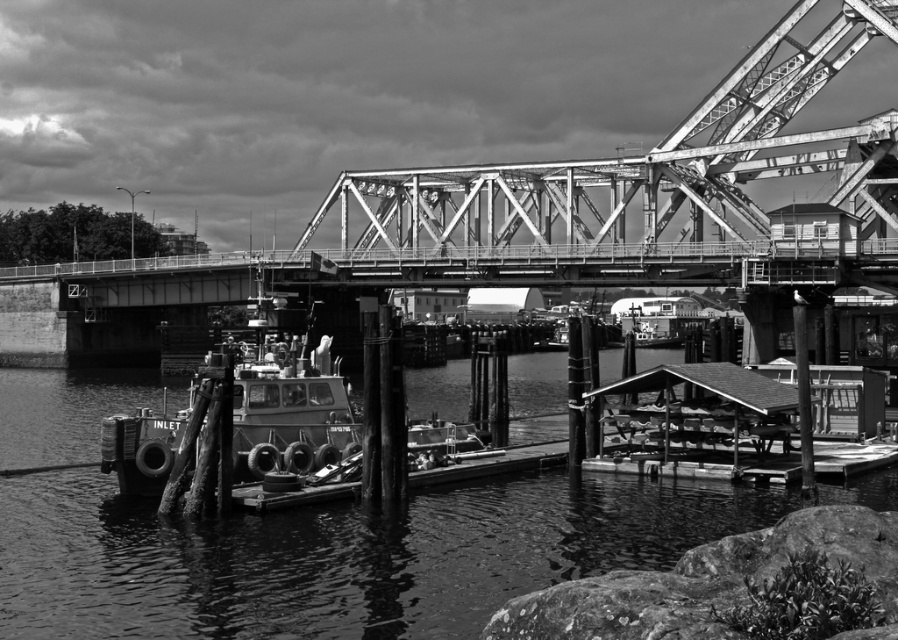
Question: Is smooth water at dock center thinner than metallic boat at center?

Choices:
 (A) no
 (B) yes

Answer: (A)

Question: In this image, where is smooth water at dock center located relative to metallic boat at center?

Choices:
 (A) left
 (B) right

Answer: (A)

Question: Which object appears farthest from the camera in this image?

Choices:
 (A) smooth water at dock center
 (B) metallic boat at center

Answer: (B)

Question: Does smooth water at dock center appear on the left side of metallic boat at center?

Choices:
 (A) no
 (B) yes

Answer: (B)

Question: Which of the following is the farthest from the observer?

Choices:
 (A) smooth water at dock center
 (B) metallic boat at center

Answer: (B)